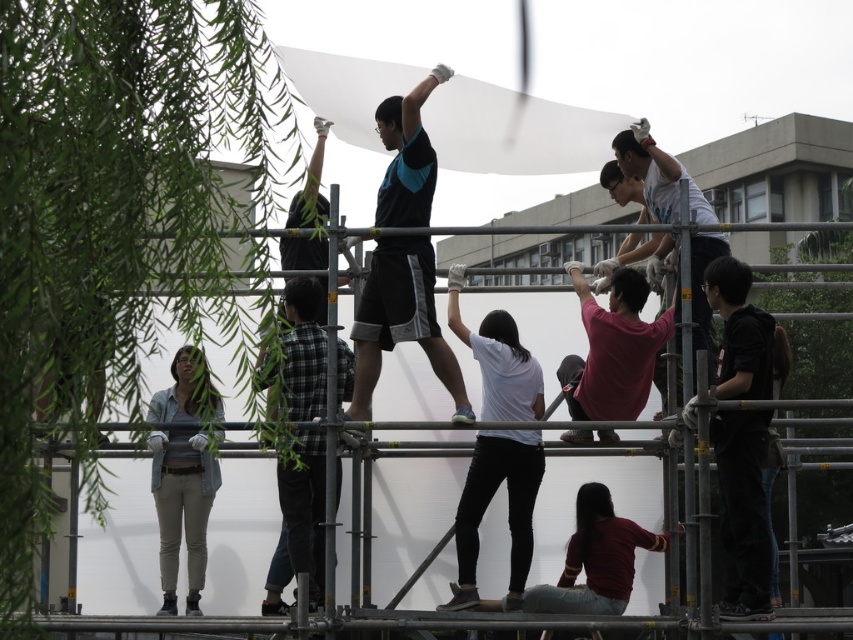
You are standing at the center of the scaffolding structure and see two points marked in the image. Which point, point (409,333) or point (401,493), is closer to you?

Point (409,333) is closer to you because it is in front of point (401,493).

You are a photographer standing in front of the construction site. You want to take a photo that includes both the black matte shorts at center and the metallic scaffolding at center. Which object will appear closer to you in the photo?

The black matte shorts at center will appear closer to you in the photo because it is positioned further to the viewer than the metallic scaffolding at center.

You are a safety inspector standing at the edge of the construction site. You need to ensure that all workers are within a safe distance of 10 meters from each other for safety protocols. Are the black matte shorts at center and the light blue shirt at upper right compliant with this requirement?

The black matte shorts at center and the light blue shirt at upper right are 7.49 meters apart, which is within the 10 meter safety distance requirement. Therefore, they are compliant with the safety protocols.